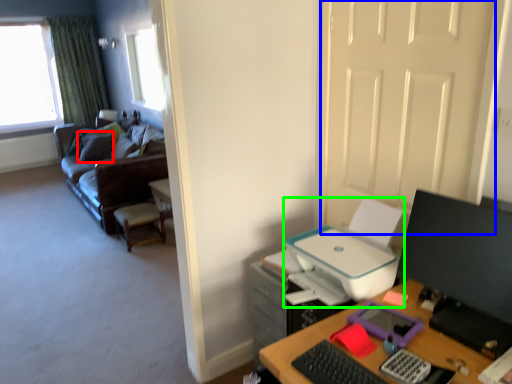
Question: Estimate the real-world distances between objects in this image. Which object is farther from pillow (highlighted by a red box), door (highlighted by a blue box) or printer (highlighted by a green box)?

Choices:
 (A) door
 (B) printer

Answer: (A)